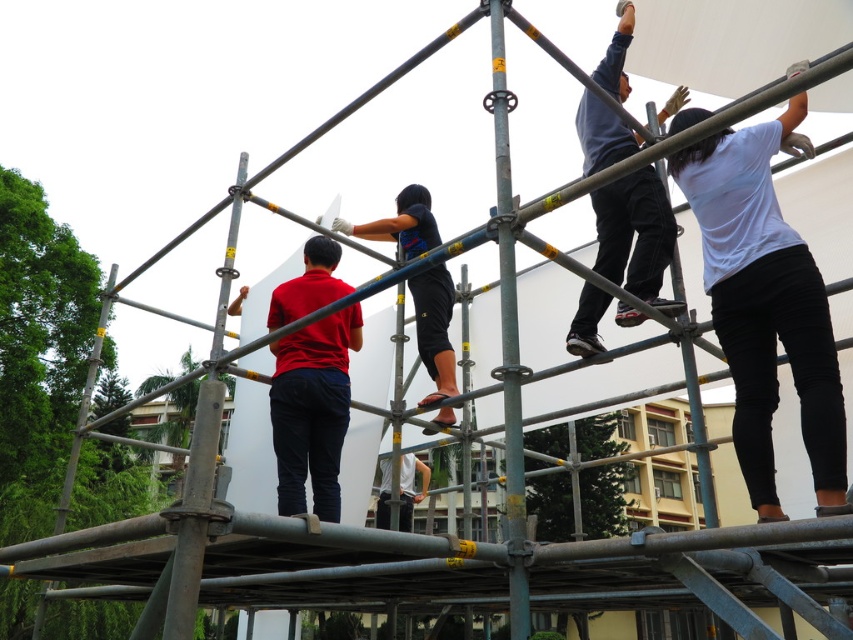
Is point (711, 292) farther from viewer compared to point (405, 230)?

That is False.

Looking at this image, can you confirm if white matte shirt at upper right is shorter than dark blue fabric shirt at center?

Incorrect, white matte shirt at upper right's height does not fall short of dark blue fabric shirt at center's.

Who is more distant from viewer, [746,358] or [436,384]?

The point [436,384] is more distant.

Find the location of a particular element. Image resolution: width=853 pixels, height=640 pixels. white matte shirt at upper right is located at coordinates (764, 307).

Describe the element at coordinates (635, 234) in the screenshot. The width and height of the screenshot is (853, 640). I see `dark blue jeans at upper right` at that location.

Can you confirm if dark blue jeans at upper right is positioned below dark blue fabric shirt at center?

Actually, dark blue jeans at upper right is above dark blue fabric shirt at center.

Does point (637, 224) come closer to viewer compared to point (437, 397)?

That is True.

The width and height of the screenshot is (853, 640). What are the coordinates of `dark blue jeans at upper right` in the screenshot? It's located at click(x=635, y=234).

Which of these two, white matte shirt at upper right or dark blue jeans at upper right, stands shorter?

dark blue jeans at upper right is shorter.

Who is more forward, (706, 145) or (602, 300)?

Point (706, 145) is in front.

Image resolution: width=853 pixels, height=640 pixels. What do you see at coordinates (764, 307) in the screenshot?
I see `white matte shirt at upper right` at bounding box center [764, 307].

I want to click on white matte shirt at upper right, so click(x=764, y=307).